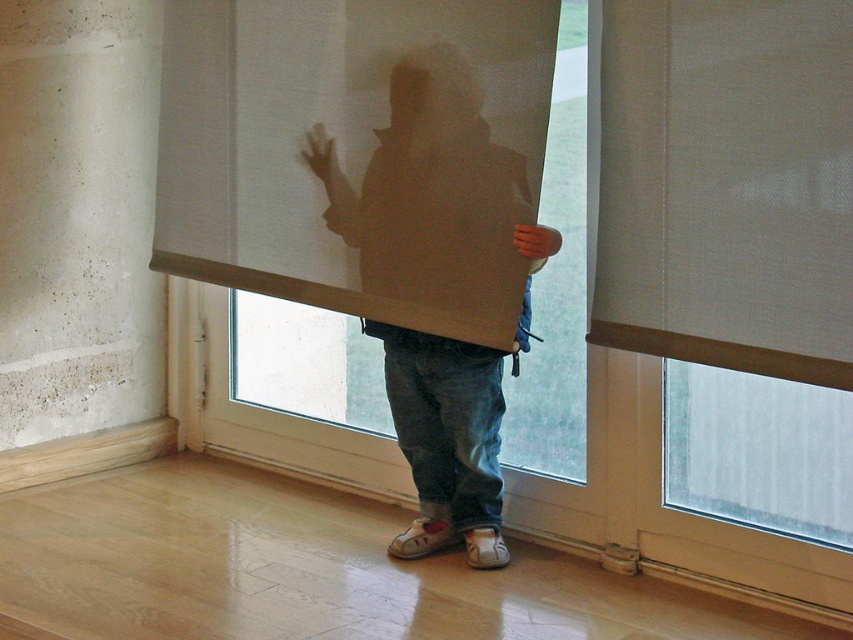
Does beige fabric curtain at upper right come behind matte cardboard box at center?

No, beige fabric curtain at upper right is in front of matte cardboard box at center.

Between point (683, 106) and point (463, 420), which one is positioned in front?

Point (683, 106) is in front.

Identify the location of beige fabric curtain at upper right. (722, 182).

Does white sheer curtain at center have a greater width compared to matte cardboard box at center?

Yes.

Which is below, white sheer curtain at center or matte cardboard box at center?

matte cardboard box at center is below.

Is point (515, 145) closer to camera compared to point (421, 484)?

Yes.

In order to click on white sheer curtain at center in this screenshot , I will do `click(357, 154)`.

Is white sheer curtain at center smaller than beige fabric curtain at upper right?

No, white sheer curtain at center is not smaller than beige fabric curtain at upper right.

Can you confirm if white sheer curtain at center is wider than beige fabric curtain at upper right?

Yes, white sheer curtain at center is wider than beige fabric curtain at upper right.

Between point (474, 138) and point (676, 307), which one is positioned in front?

Point (676, 307) is more forward.

The height and width of the screenshot is (640, 853). Find the location of `white sheer curtain at center`. white sheer curtain at center is located at coordinates (357, 154).